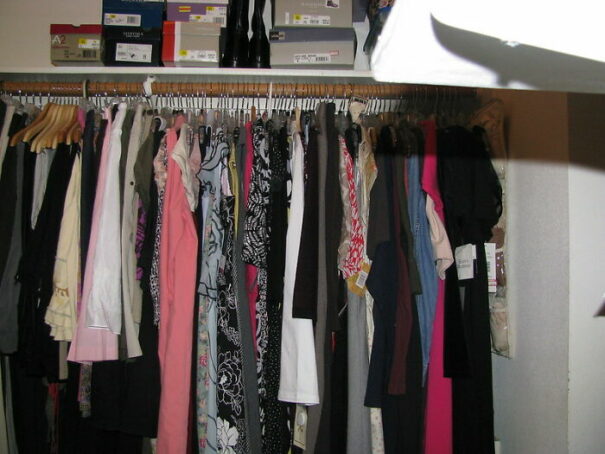
I want to click on shoe box, so click(x=79, y=46), click(x=120, y=52), click(x=129, y=18), click(x=187, y=48), click(x=204, y=12), click(x=324, y=49), click(x=309, y=8).